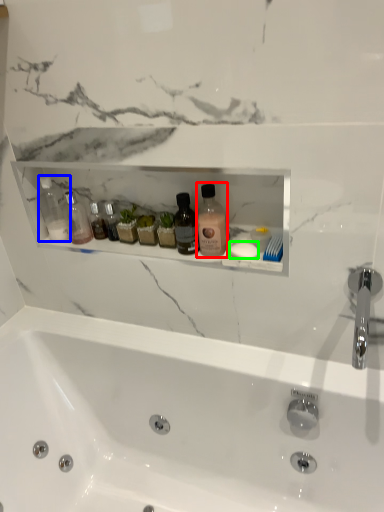
Question: Considering the real-world distances, which object is farthest from cleaning product (highlighted by a red box)? toiletry (highlighted by a blue box) or soap (highlighted by a green box)?

Choices:
 (A) toiletry
 (B) soap

Answer: (A)